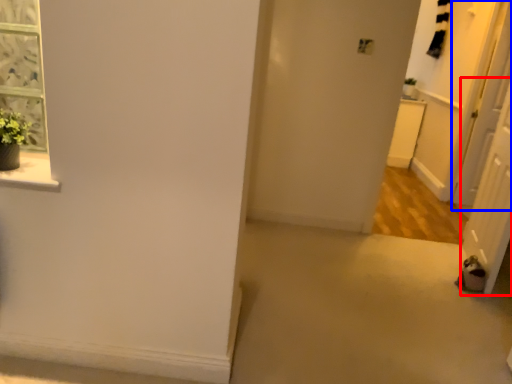
Question: Which object appears farthest to the camera in this image, screen door (highlighted by a red box) or screen door (highlighted by a blue box)?

Choices:
 (A) screen door
 (B) screen door

Answer: (B)